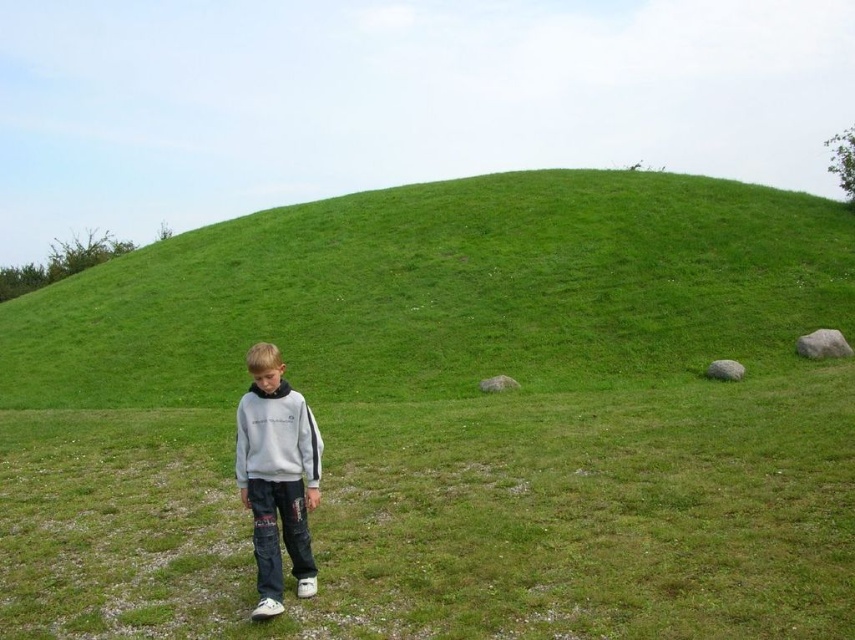
You are standing at the center of the image and want to walk towards the green grassy hillside at center. In which direction should you move?

Since the green grassy hillside at center is already at the center of the image, you are already facing it. Move straight ahead to reach it.

You are a photographer trying to capture the boy in the scene. The gray cotton sweatshirt at center is represented by point (276, 476). Where should you position your camera to ensure the boy is centered in the frame?

The gray cotton sweatshirt at center is represented by point (276, 476), so positioning the camera at this coordinate will center the boy in the frame.